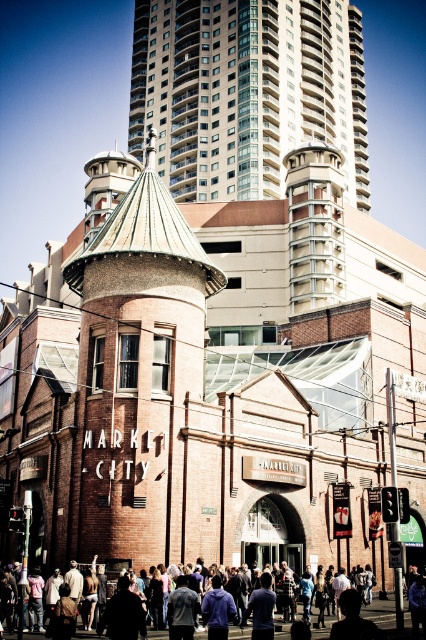
You are standing in front of Market City and notice two elements in the scene. One is the white glass tower at upper center and the other is the dark blue shirt at center. Which of these two elements is positioned higher up in the image?

The white glass tower at upper center is positioned higher up in the image than the dark blue shirt at center.

You are standing in front of Market City and want to take a photo that includes both the brick tower at center and the white glass tower at upper center. Which tower should you position to the left side of your photo to capture both in the frame?

You should position the brick tower at center to the left side of your photo because it is already located to the left of the white glass tower at upper center in the scene.

You are standing at the entrance of Market City and want to take a photo of both the white glass tower at upper center and the dark blue shirt at center in the same frame. Given that your camera has a maximum zoom range of 100 meters, will you be able to capture both objects in a single photo?

The white glass tower at upper center and the dark blue shirt at center are 122.92 meters apart. Since your camera can only zoom up to 100 meters, you won cannot capture both objects in a single photo as the distance exceeds the maximum zoom range.